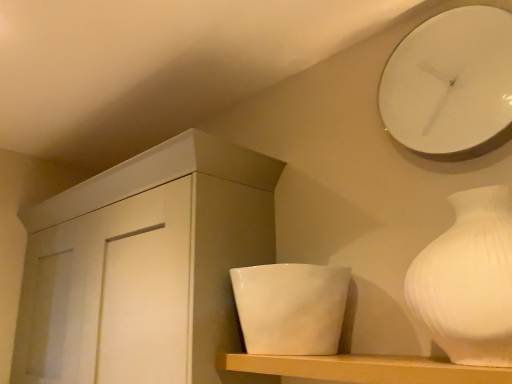
Question: From the image's perspective, is white glossy clock at upper right over white matte cabinet at center?

Choices:
 (A) no
 (B) yes

Answer: (B)

Question: Is white glossy clock at upper right positioned with its back to white matte cabinet at center?

Choices:
 (A) no
 (B) yes

Answer: (A)

Question: From the image's perspective, is white glossy clock at upper right below white matte cabinet at center?

Choices:
 (A) no
 (B) yes

Answer: (A)

Question: From a real-world perspective, is white glossy clock at upper right beneath white matte cabinet at center?

Choices:
 (A) yes
 (B) no

Answer: (B)

Question: Is white glossy clock at upper right oriented towards white matte cabinet at center?

Choices:
 (A) yes
 (B) no

Answer: (B)

Question: Choose the correct answer: Is white matte vase at right inside white matte cabinet at center or outside it?

Choices:
 (A) outside
 (B) inside

Answer: (A)

Question: Considering the positions of white matte vase at right and white matte cabinet at center in the image, is white matte vase at right bigger or smaller than white matte cabinet at center?

Choices:
 (A) small
 (B) big

Answer: (A)

Question: In terms of width, does white matte vase at right look wider or thinner when compared to white matte cabinet at center?

Choices:
 (A) thin
 (B) wide

Answer: (A)

Question: From a real-world perspective, is white matte vase at right positioned above or below white matte cabinet at center?

Choices:
 (A) below
 (B) above

Answer: (A)

Question: Considering the relative positions of white matte vase at right and white glossy bowl at center in the image provided, is white matte vase at right to the left or to the right of white glossy bowl at center?

Choices:
 (A) right
 (B) left

Answer: (A)

Question: Does point (464, 230) appear closer or farther from the camera than point (287, 327)?

Choices:
 (A) closer
 (B) farther

Answer: (A)

Question: Considering their positions, is white matte vase at right located in front of or behind white glossy bowl at center?

Choices:
 (A) front
 (B) behind

Answer: (A)

Question: From a real-world perspective, is white matte vase at right physically located above or below white glossy bowl at center?

Choices:
 (A) below
 (B) above

Answer: (B)

Question: Based on their sizes in the image, would you say white matte vase at right is bigger or smaller than white glossy clock at upper right?

Choices:
 (A) small
 (B) big

Answer: (B)

Question: From a real-world perspective, is white matte vase at right positioned above or below white glossy clock at upper right?

Choices:
 (A) above
 (B) below

Answer: (B)